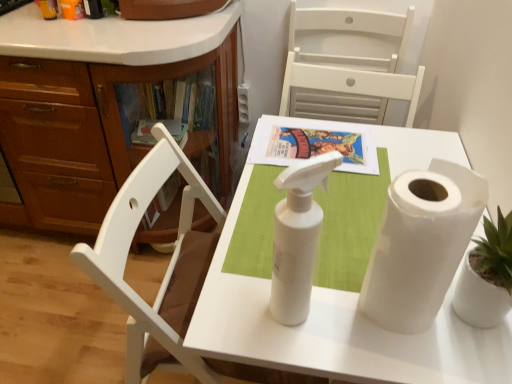
Locate an element on the screen. The width and height of the screenshot is (512, 384). free location to the right of white matte spray bottle at center is located at coordinates (376, 327).